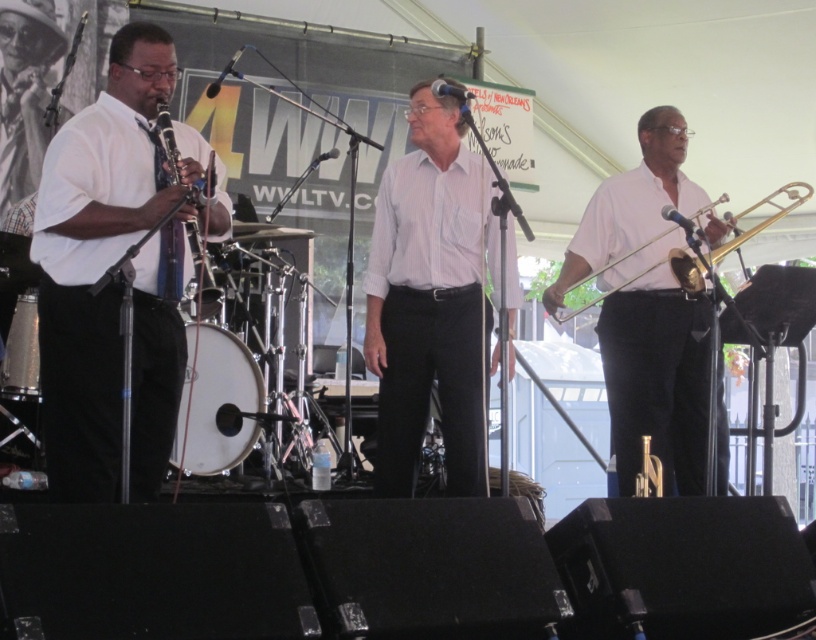
Question: Is matte white shirt at left above white striped shirt at center?

Choices:
 (A) no
 (B) yes

Answer: (B)

Question: Which point is farther to the camera?

Choices:
 (A) (726, 230)
 (B) (50, 12)
 (C) (204, 250)

Answer: (B)

Question: Which of these objects is positioned closest to the gold brass trombone at right?

Choices:
 (A) white matte trombone at center
 (B) matte white shirt at left

Answer: (A)

Question: Can you confirm if matte white shirt at left is wider than gold brass trombone at right?

Choices:
 (A) no
 (B) yes

Answer: (A)

Question: Which point is farther to the camera?

Choices:
 (A) matte white shirt at left
 (B) white matte trombone at center

Answer: (B)

Question: Does white striped shirt at center appear on the left side of matte black clarinet at left?

Choices:
 (A) no
 (B) yes

Answer: (A)